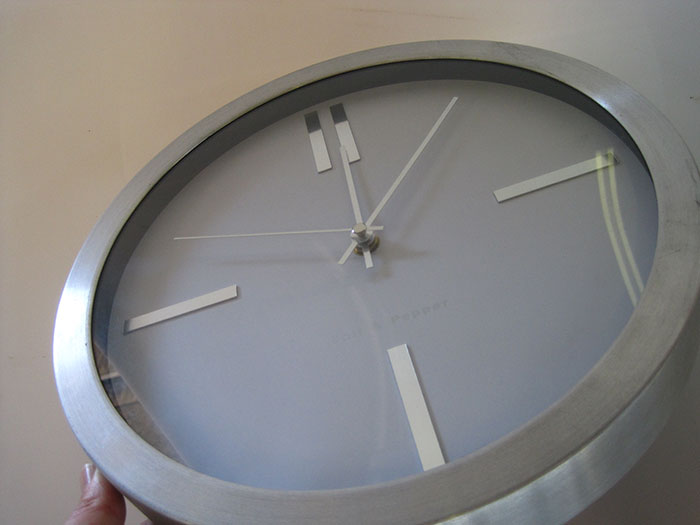
You are a GUI agent. You are given a task and a screenshot of the screen. Output one action in this format:
    pyautogui.click(x=<x>, y=<y>)
    Task: Click on the white wall
    This screenshot has height=525, width=700.
    Given the screenshot: What is the action you would take?
    pyautogui.click(x=108, y=65)